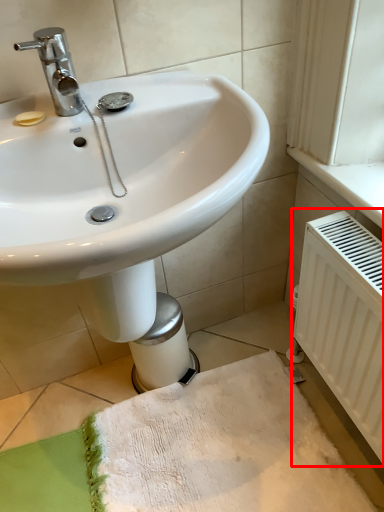
Question: From the image, what is the correct spatial relationship of radiator (annotated by the red box) in relation to bath towel?

Choices:
 (A) left
 (B) right

Answer: (B)